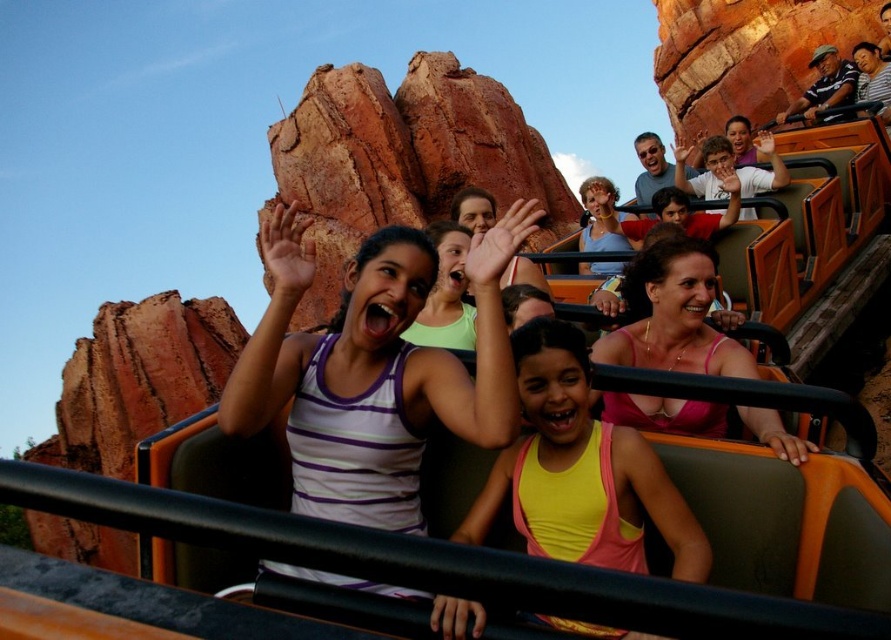
Which of these two, white striped tank top at center or yellow matte tank top at center, stands shorter?

With less height is yellow matte tank top at center.

Does white striped tank top at center lie behind yellow matte tank top at center?

That is True.

Between point (407, 406) and point (586, 467), which one is positioned in front?

Point (586, 467)

Locate an element on the screen. white striped tank top at center is located at coordinates (374, 371).